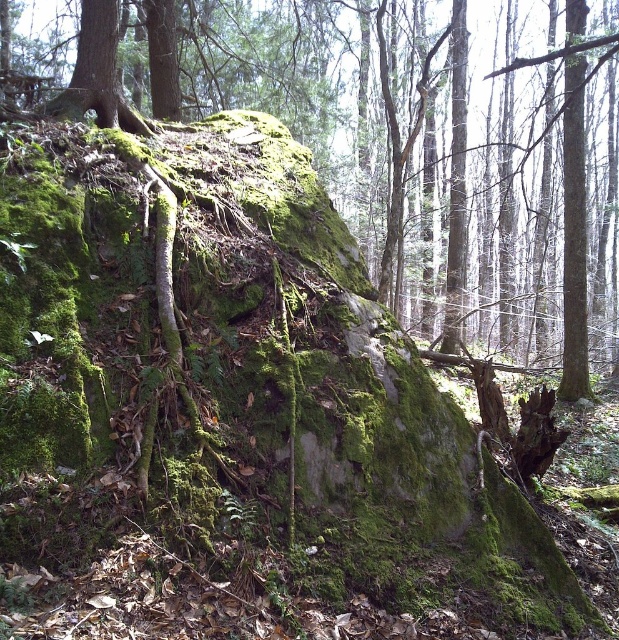
You are a hiker who wants to walk from the point at coordinate (x=217, y=58) to the point at coordinate 0.135, 0.678. The forest path is narrow and can only accommodate a person 0.5 meters wide. Can you safely walk along the path between these two points?

The path between the two points is 9.62 meters wide, which is more than enough for a person 0.5 meters wide to walk safely.

You are a hiker who wants to climb the green mossy rock at center and the green mossy rock at upper right. Which rock should you choose if you want to climb a taller one?

The green mossy rock at center is much taller than the green mossy rock at upper right, so you should choose the green mossy rock at center to climb.